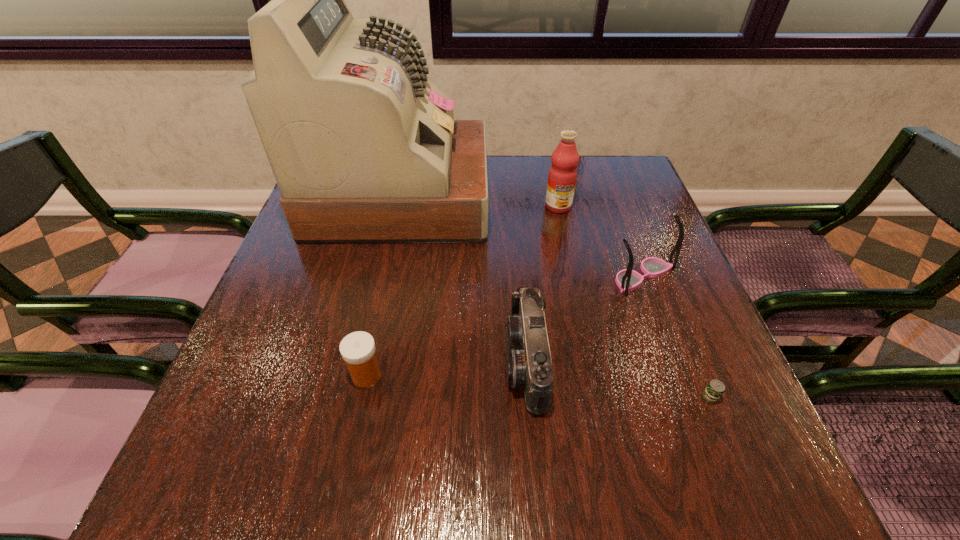
The height and width of the screenshot is (540, 960). What are the coordinates of `vacant space that is in between the medicine and the tallest object` in the screenshot? It's located at (383, 286).

Where is `vacant space in between the spectacles and the camcorder`? Image resolution: width=960 pixels, height=540 pixels. vacant space in between the spectacles and the camcorder is located at coordinates (585, 319).

Locate an element on the screen. The width and height of the screenshot is (960, 540). free space that is in between the tallest object and the shortest object is located at coordinates (555, 297).

Where is `blank region between the camcorder and the medicine`? This screenshot has width=960, height=540. blank region between the camcorder and the medicine is located at coordinates (446, 368).

Where is `vacant point located between the shortest object and the spectacles`? This screenshot has height=540, width=960. vacant point located between the shortest object and the spectacles is located at coordinates (676, 337).

At what (x,y) coordinates should I click in order to perform the action: click on free space between the third object from left to right and the fourth shortest object. Please return your answer as a coordinate pair (x, y). Looking at the image, I should click on (585, 319).

This screenshot has width=960, height=540. In order to click on vacant point located between the beer can and the spectacles in this screenshot , I will do `click(676, 337)`.

The image size is (960, 540). In order to click on free spot between the second tallest object and the beer can in this screenshot , I will do `click(634, 302)`.

Find the location of a particular element. The height and width of the screenshot is (540, 960). object that is the second closest one to the camcorder is located at coordinates (364, 149).

Where is `the fourth closest object relative to the camcorder`? The height and width of the screenshot is (540, 960). the fourth closest object relative to the camcorder is located at coordinates pyautogui.click(x=714, y=390).